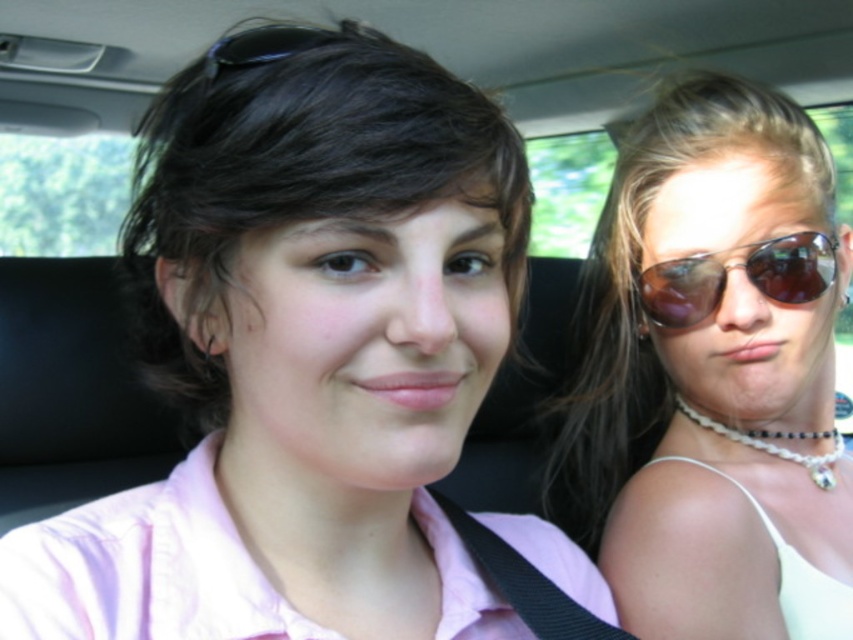
Question: Can you confirm if matte pink shirt at center is smaller than brown reflective sunglasses at right?

Choices:
 (A) no
 (B) yes

Answer: (A)

Question: Considering the real-world distances, which object is closest to the brown reflective sunglasses at right?

Choices:
 (A) sunglasses at right
 (B) matte pink shirt at center

Answer: (A)

Question: Is sunglasses at right wider than matte pink shirt at center?

Choices:
 (A) yes
 (B) no

Answer: (A)

Question: From the image, what is the correct spatial relationship of sunglasses at right in relation to matte pink shirt at center?

Choices:
 (A) right
 (B) left

Answer: (A)

Question: Which of the following is the closest to the observer?

Choices:
 (A) (698, 184)
 (B) (811, 289)
 (C) (270, 76)

Answer: (C)

Question: Which of these objects is positioned farthest from the brown reflective sunglasses at right?

Choices:
 (A) matte pink shirt at center
 (B) sunglasses at right

Answer: (A)